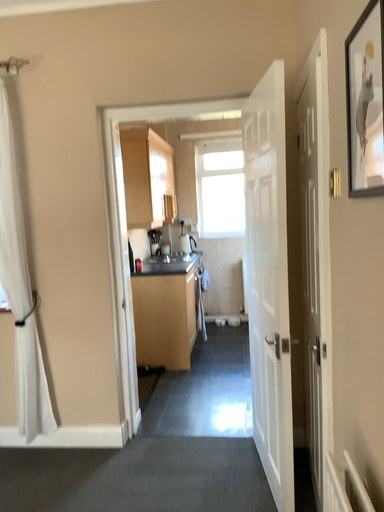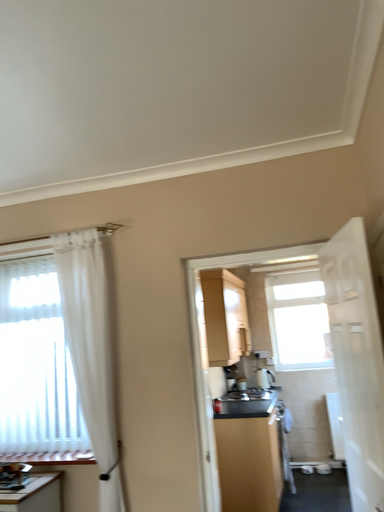
Question: How did the camera likely rotate when shooting the video?

Choices:
 (A) rotated left
 (B) rotated right

Answer: (A)